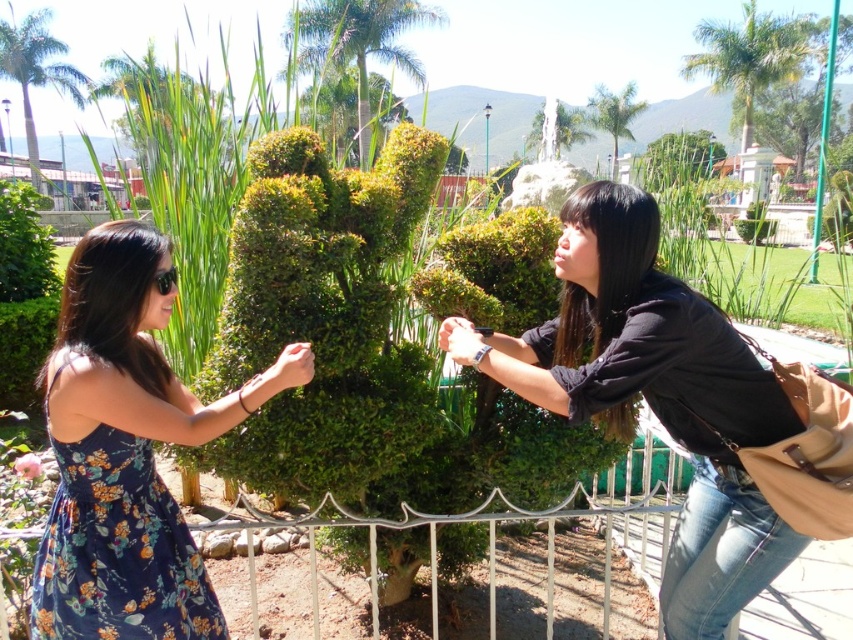
Looking at this image, can you confirm if floral dress at left is positioned to the right of floral print fabric dress at lower left?

Indeed, floral dress at left is positioned on the right side of floral print fabric dress at lower left.

How far apart are floral dress at left and floral print fabric dress at lower left?

floral dress at left and floral print fabric dress at lower left are 2.76 inches apart from each other.

Which is behind, point (84, 637) or point (158, 496)?

Positioned behind is point (158, 496).

You are a GUI agent. You are given a task and a screenshot of the screen. Output one action in this format:
    pyautogui.click(x=<x>, y=<y>)
    Task: Click on the floral dress at left
    Image resolution: width=853 pixels, height=640 pixels.
    Given the screenshot: What is the action you would take?
    pyautogui.click(x=126, y=451)

Who is taller, green leafy bush at left or pink matte flower at lower left?

With more height is green leafy bush at left.

I want to click on green leafy bush at left, so click(x=24, y=246).

Describe the element at coordinates (126, 451) in the screenshot. The height and width of the screenshot is (640, 853). I see `floral dress at left` at that location.

Find the location of a particular element. floral dress at left is located at coordinates (126, 451).